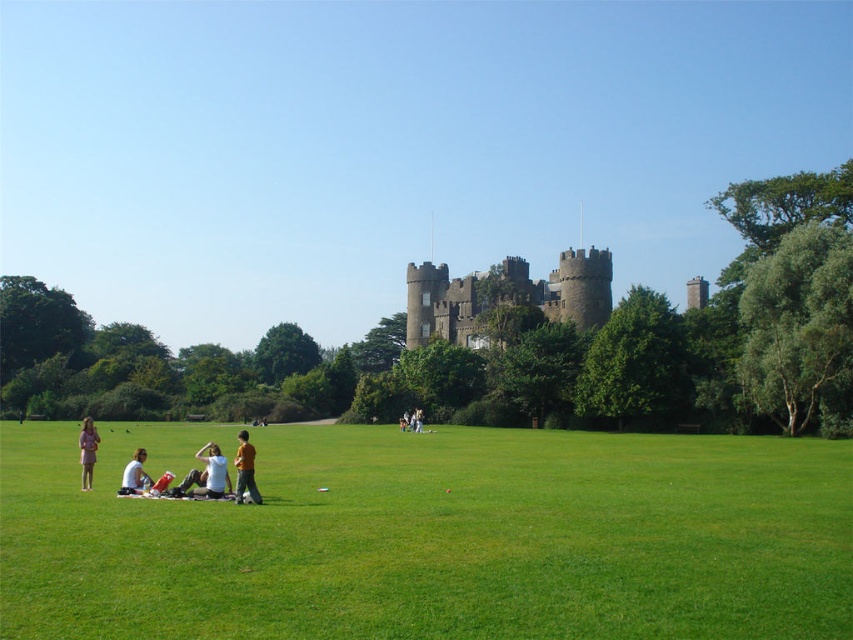
Question: Does white cotton shirt at lower left have a larger size compared to light brown leather jacket at center?

Choices:
 (A) yes
 (B) no

Answer: (A)

Question: Can you confirm if white cotton shirt at lower center is bigger than pink fabric dress at lower left?

Choices:
 (A) no
 (B) yes

Answer: (A)

Question: Does brown leather jacket at lower center have a larger size compared to white cotton shirt at lower left?

Choices:
 (A) no
 (B) yes

Answer: (B)

Question: Which object is closer to the camera taking this photo?

Choices:
 (A) white cotton shirt at lower left
 (B) pink fabric dress at lower left
 (C) white cotton shirt at lower center
 (D) green grass at lower center

Answer: (D)

Question: Estimate the real-world distances between objects in this image. Which object is farther from the white cotton shirt at lower center?

Choices:
 (A) light brown leather jacket at center
 (B) brown stone castle at center

Answer: (B)

Question: Among these points, which one is nearest to the camera?

Choices:
 (A) [x=404, y=412]
 (B) [x=125, y=492]

Answer: (B)